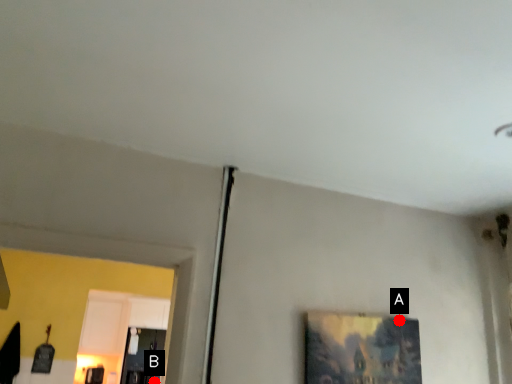
Question: Two points are circled on the image, labeled by A and B beside each circle. Which point is further to the camera?

Choices:
 (A) A is further
 (B) B is further

Answer: (B)